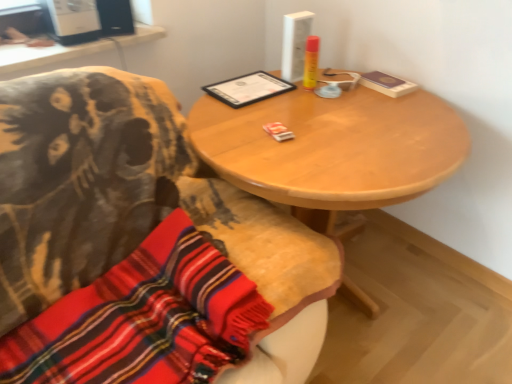
Question: From a real-world perspective, relative to white plastic computer desk at upper left, is knitted wool scarf at lower left vertically above or below?

Choices:
 (A) above
 (B) below

Answer: (B)

Question: From the image's perspective, is knitted wool scarf at lower left above or below white plastic computer desk at upper left?

Choices:
 (A) above
 (B) below

Answer: (B)

Question: Which is nearer to the wooden chair at center?

Choices:
 (A) white plastic computer desk at upper left
 (B) wooden table at center
 (C) knitted wool scarf at lower left

Answer: (C)

Question: Which object is the farthest from the wooden table at center?

Choices:
 (A) wooden chair at center
 (B) white plastic computer desk at upper left
 (C) knitted wool scarf at lower left

Answer: (B)